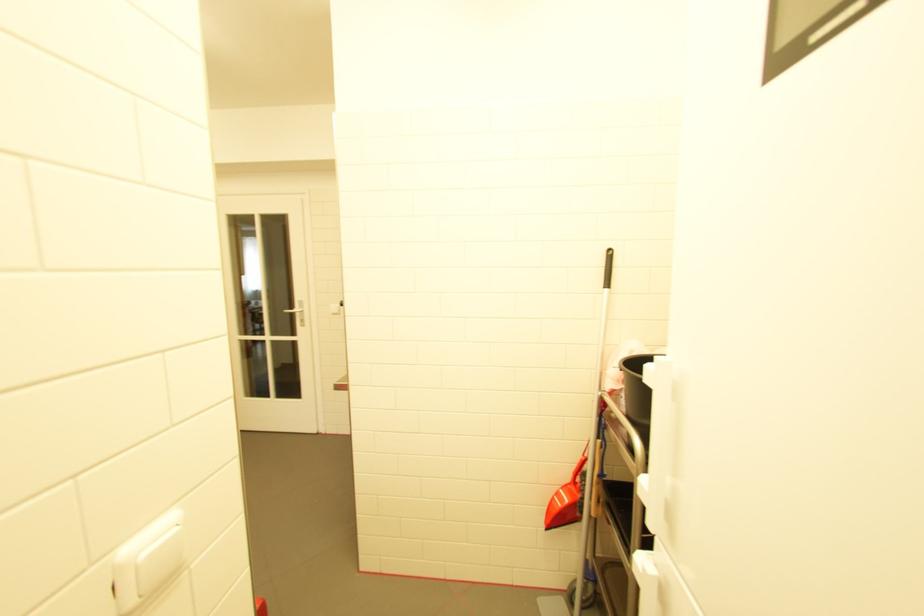
Image resolution: width=924 pixels, height=616 pixels. I want to click on white light switch, so click(159, 562).